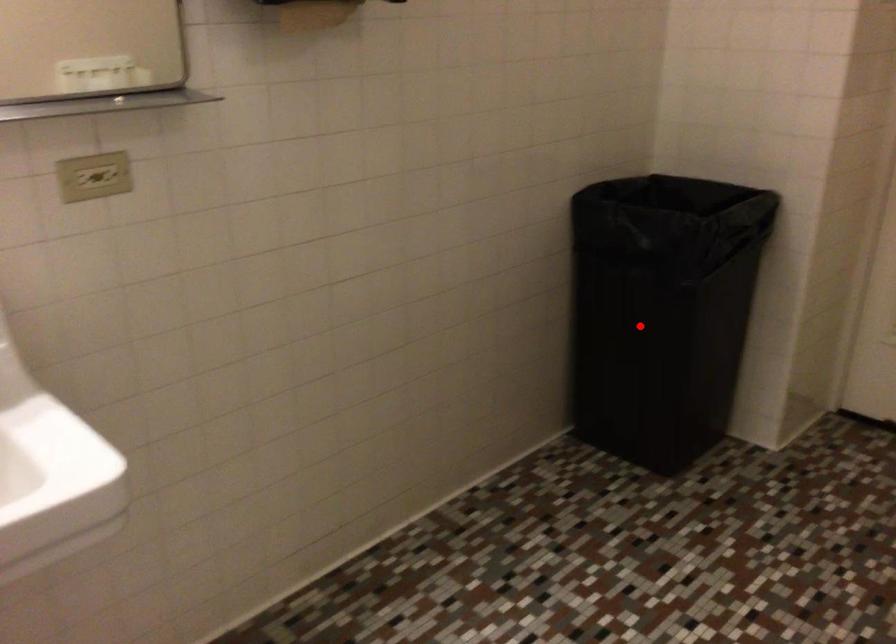
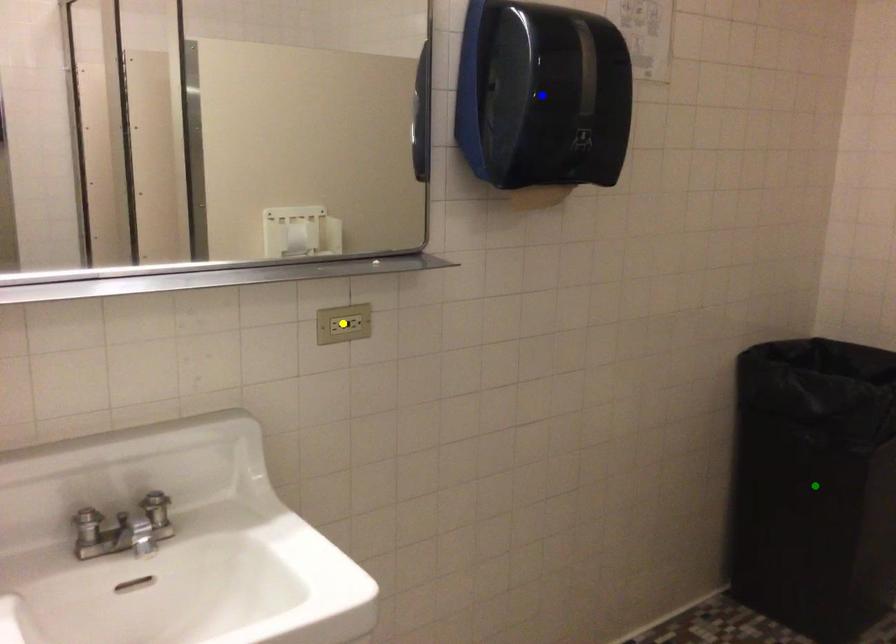
Question: I am providing you with two images of the same scene from different viewpoints. A red point is marked on the first image. You are given multiple points on the second image. Which point in image 2 represents the same 3d spot as the red point in image 1?

Choices:
 (A) yellow point
 (B) blue point
 (C) green point

Answer: (C)